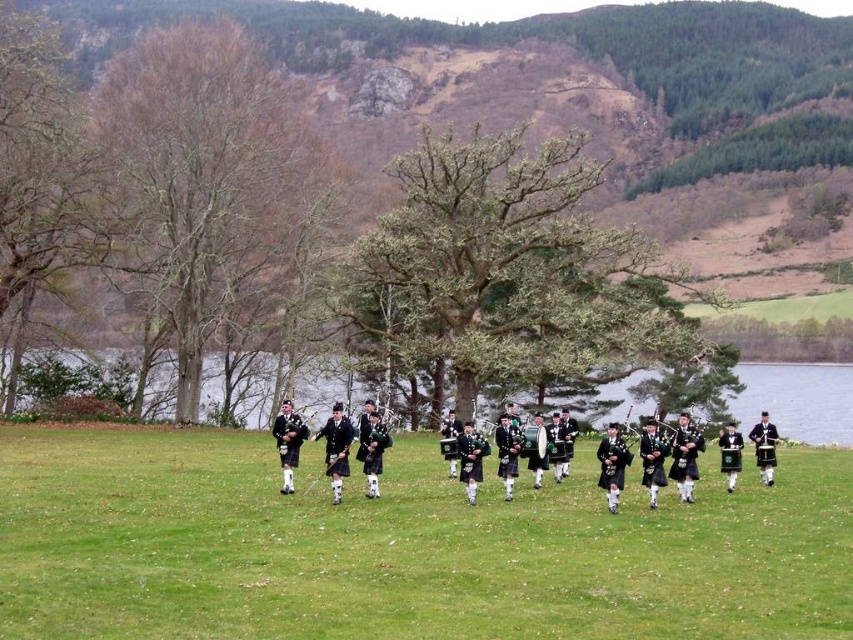
Can you confirm if green grass at center is smaller than green leafy tree at center?

Indeed, green grass at center has a smaller size compared to green leafy tree at center.

Does green grass at center have a larger size compared to green leafy tree at center?

No, green grass at center is not bigger than green leafy tree at center.

Locate an element on the screen. green grass at center is located at coordinates (401, 547).

Does green grass at center appear under bare wood at left?

Indeed, green grass at center is positioned under bare wood at left.

Can you confirm if green grass at center is positioned to the left of bare wood at left?

In fact, green grass at center is to the right of bare wood at left.

Is point (347, 500) farther from camera compared to point (270, 282)?

No, it is not.

I want to click on green grass at center, so click(401, 547).

Who is more forward, [612,284] or [149,192]?

Point [149,192] is more forward.

Who is positioned more to the right, green leafy tree at center or bare wood at left?

Positioned to the right is green leafy tree at center.

From the picture: Who is more forward, [614,356] or [202,51]?

Point [614,356]

Locate an element on the screen. The height and width of the screenshot is (640, 853). green leafy tree at center is located at coordinates (509, 273).